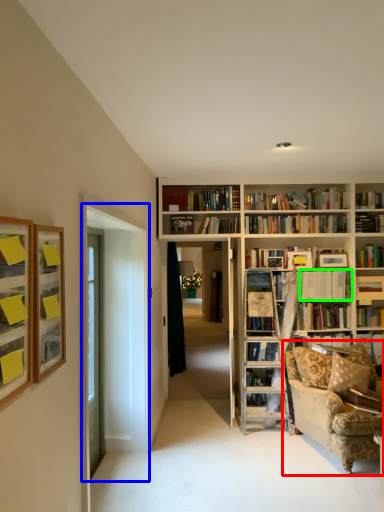
Question: Based on their relative distances, which object is farther from studio couch (highlighted by a red box)? Choose from glass door (highlighted by a blue box) and book (highlighted by a green box).

Choices:
 (A) glass door
 (B) book

Answer: (A)